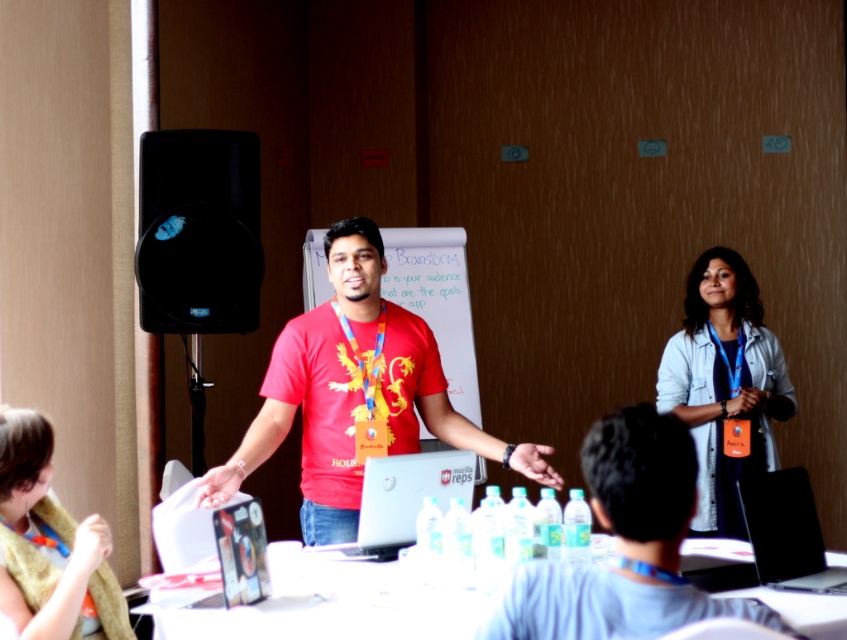
Question: Among these objects, which one is nearest to the camera?

Choices:
 (A) black glossy laptop at center
 (B) fluffy beige scarf at lower left
 (C) denim jacket at upper right

Answer: (B)

Question: Is red matte t-shirt at center thinner than black glossy laptop at center?

Choices:
 (A) yes
 (B) no

Answer: (B)

Question: Can you confirm if matte red shirt at center is wider than denim jacket at upper right?

Choices:
 (A) yes
 (B) no

Answer: (B)

Question: Is red matte t-shirt at center to the right of black glossy laptop at center from the viewer's perspective?

Choices:
 (A) yes
 (B) no

Answer: (B)

Question: Which object is closer to the camera taking this photo?

Choices:
 (A) white glossy table at lower center
 (B) matte red shirt at center
 (C) silver metallic laptop at center

Answer: (B)

Question: Which object appears farthest from the camera in this image?

Choices:
 (A) silver metallic laptop at center
 (B) red matte t-shirt at center

Answer: (B)